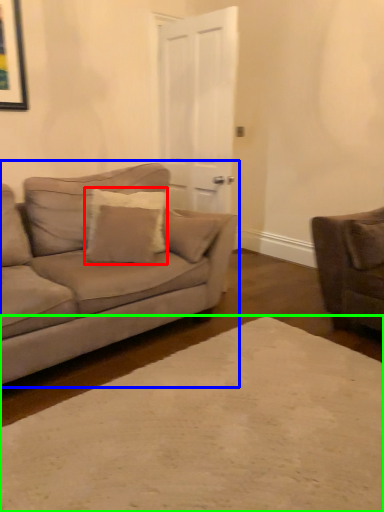
Question: Which is farther away from pillow (highlighted by a red box)? studio couch (highlighted by a blue box) or plain (highlighted by a green box)?

Choices:
 (A) studio couch
 (B) plain

Answer: (B)